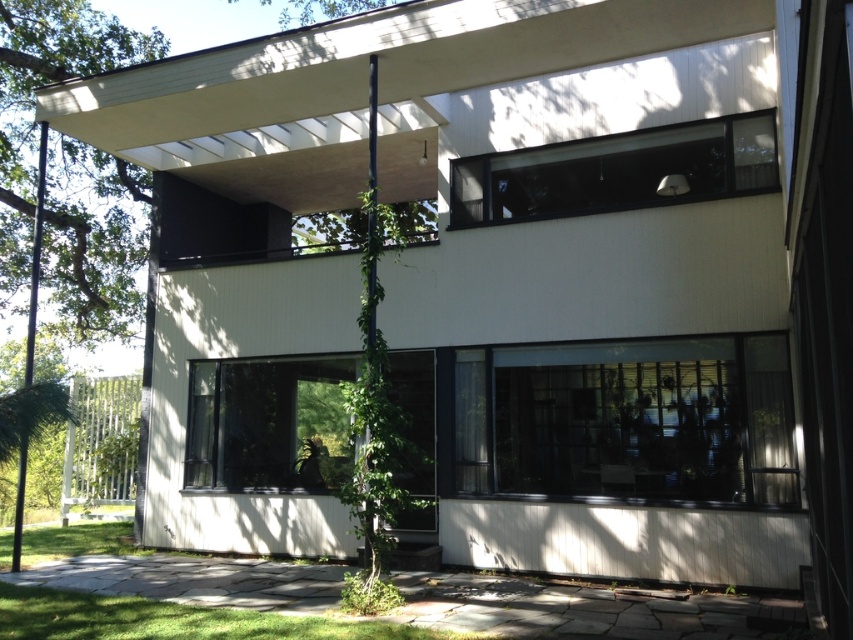
Question: Which point appears closest to the camera in this image?

Choices:
 (A) (125, 333)
 (B) (300, 17)

Answer: (A)

Question: Which object is farther from the camera taking this photo?

Choices:
 (A) green leafy tree at left
 (B) green leafy tree at upper center

Answer: (B)

Question: Does green leafy tree at left appear under green leafy tree at upper center?

Choices:
 (A) no
 (B) yes

Answer: (B)

Question: Which point is farther to the camera?

Choices:
 (A) coord(67,177)
 (B) coord(289,13)

Answer: (B)

Question: Can you confirm if green leafy tree at left is smaller than green leafy tree at upper center?

Choices:
 (A) yes
 (B) no

Answer: (B)

Question: Is green leafy tree at left thinner than green leafy tree at upper center?

Choices:
 (A) no
 (B) yes

Answer: (A)